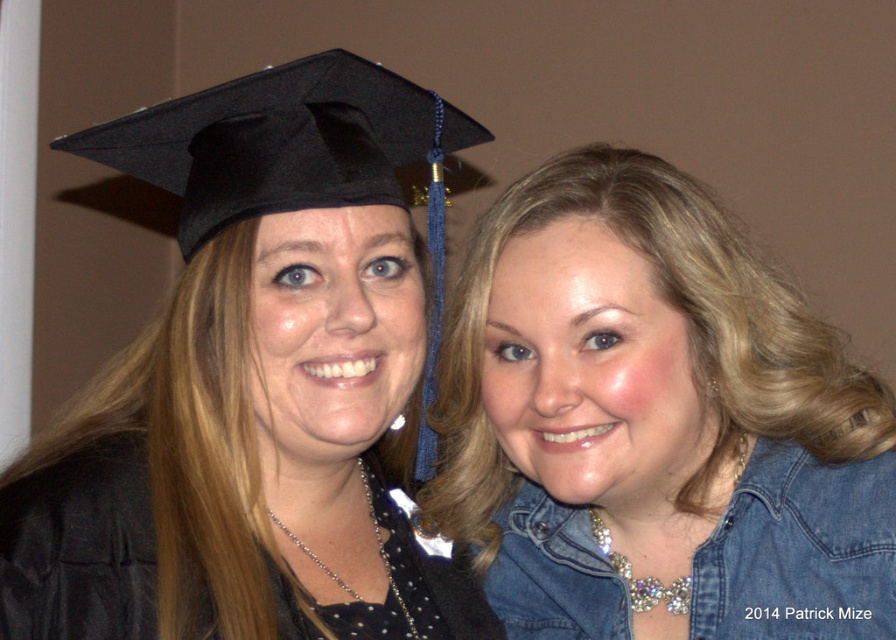
Question: Among these points, which one is farthest from the camera?

Choices:
 (A) (69, 476)
 (B) (649, 381)
 (C) (109, 163)
 (D) (570, 602)

Answer: (C)

Question: Is denim jacket at upper right to the right of black matte gown at left from the viewer's perspective?

Choices:
 (A) no
 (B) yes

Answer: (B)

Question: Does denim jacket at lower right have a lesser width compared to black matte gown at left?

Choices:
 (A) no
 (B) yes

Answer: (B)

Question: Among these points, which one is nearest to the camera?

Choices:
 (A) (444, 602)
 (B) (326, 67)
 (C) (544, 326)
 (D) (881, 513)

Answer: (C)

Question: Which of the following is the closest to the observer?

Choices:
 (A) black matte gown at left
 (B) black matte graduation cap at upper left

Answer: (A)

Question: Is denim jacket at upper right in front of black matte graduation cap at upper left?

Choices:
 (A) no
 (B) yes

Answer: (B)